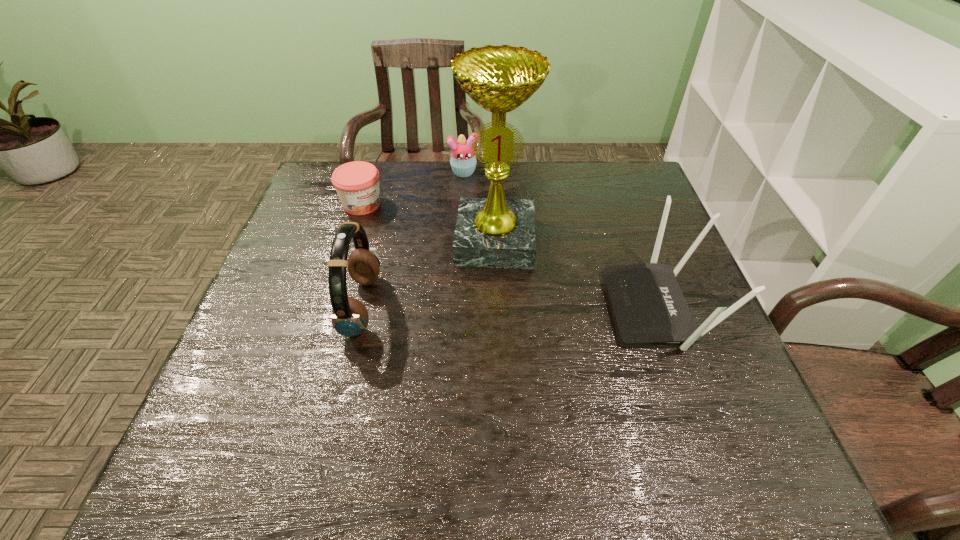
Where is `headset`? The height and width of the screenshot is (540, 960). headset is located at coordinates (350, 317).

You are a GUI agent. You are given a task and a screenshot of the screen. Output one action in this format:
    pyautogui.click(x=<x>, y=<y>)
    Task: Click on the rightmost object
    
    Given the screenshot: What is the action you would take?
    pyautogui.click(x=649, y=307)

Where is `the tallest object`? the tallest object is located at coordinates (496, 232).

You are a GUI agent. You are given a task and a screenshot of the screen. Output one action in this format:
    pyautogui.click(x=<x>, y=<y>)
    Task: Click on the jam
    Image resolution: width=960 pixels, height=540 pixels.
    Given the screenshot: What is the action you would take?
    pyautogui.click(x=357, y=183)

You are a GUI agent. You are given a task and a screenshot of the screen. Output one action in this format:
    pyautogui.click(x=<x>, y=<y>)
    Task: Click on the second shortest object
    The width and height of the screenshot is (960, 540).
    Given the screenshot: What is the action you would take?
    pyautogui.click(x=463, y=162)

Find the location of a particular element. cupcake is located at coordinates (463, 162).

Where is `free space located on the ear cup of the headset`? The image size is (960, 540). free space located on the ear cup of the headset is located at coordinates (273, 307).

Find the location of a particular element. This screenshot has height=540, width=960. vacant point located 0.060m on the ear cup of the headset is located at coordinates (320, 307).

This screenshot has width=960, height=540. I want to click on vacant area situated 0.210m on the ear cup of the headset, so click(x=255, y=307).

The height and width of the screenshot is (540, 960). What are the coordinates of `free space located on the front-facing side of the router` in the screenshot? It's located at (505, 308).